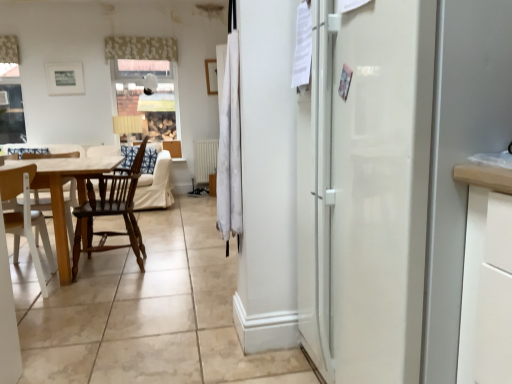
Where is `vacant area that lies in front of dark brown wood chair at left, arranged as the 1th chair when viewed from the right`? This screenshot has height=384, width=512. vacant area that lies in front of dark brown wood chair at left, arranged as the 1th chair when viewed from the right is located at coordinates (106, 295).